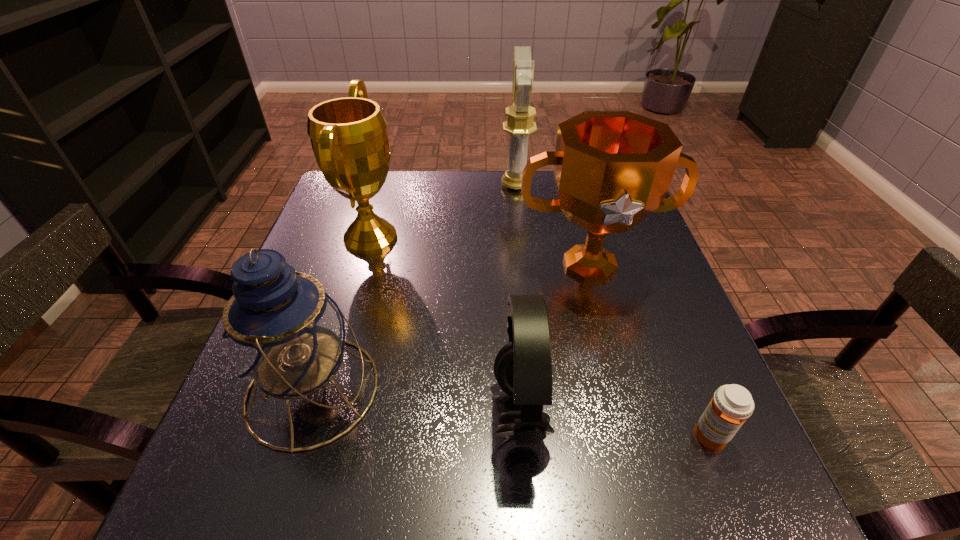
Find the location of a particular element. This screenshot has width=960, height=540. the second closest award relative to the farthest award is located at coordinates (349, 138).

Where is `free spot that satisfies the following two spatial constraints: 1. on the ear cups of the earphone; 2. on the back side of the shortest object`? The image size is (960, 540). free spot that satisfies the following two spatial constraints: 1. on the ear cups of the earphone; 2. on the back side of the shortest object is located at coordinates (522, 437).

Locate an element on the screen. The width and height of the screenshot is (960, 540). vacant region that satisfies the following two spatial constraints: 1. on the front-facing side of the farthest object; 2. on the right side of the medicine is located at coordinates (544, 437).

Where is `blank space that satisfies the following two spatial constraints: 1. on the front-facing side of the shortest object; 2. on the right side of the leftmost award`? The width and height of the screenshot is (960, 540). blank space that satisfies the following two spatial constraints: 1. on the front-facing side of the shortest object; 2. on the right side of the leftmost award is located at coordinates (312, 437).

Find the location of a particular element. free location that satisfies the following two spatial constraints: 1. on the back side of the shortest object; 2. on the ear cups of the fifth tallest object is located at coordinates (701, 411).

This screenshot has height=540, width=960. I want to click on free space that satisfies the following two spatial constraints: 1. on the front-facing side of the lantern; 2. on the left side of the shortest object, so click(x=298, y=437).